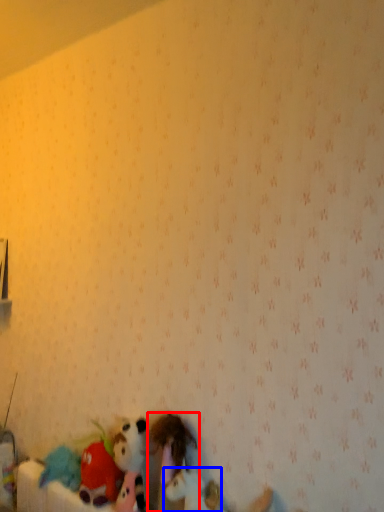
Question: Which of the following is the farthest to the observer, toy (highlighted by a red box) or toy (highlighted by a blue box)?

Choices:
 (A) toy
 (B) toy

Answer: (A)